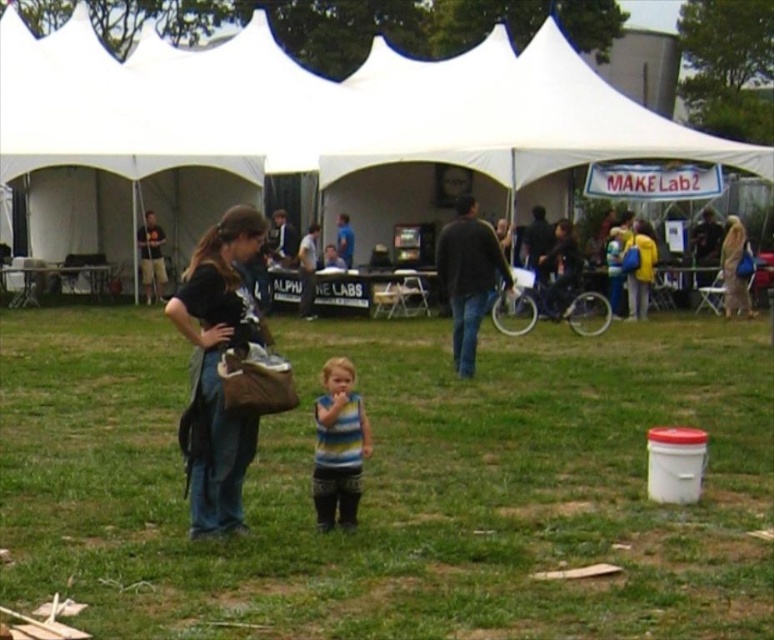
Can you confirm if white fabric tent at center is bigger than matte black shirt at center?

Correct, white fabric tent at center is larger in size than matte black shirt at center.

Image resolution: width=774 pixels, height=640 pixels. What do you see at coordinates (317, 113) in the screenshot?
I see `white fabric tent at center` at bounding box center [317, 113].

I want to click on white fabric tent at center, so click(317, 113).

The image size is (774, 640). What are the coordinates of `white fabric tent at center` in the screenshot? It's located at (317, 113).

The width and height of the screenshot is (774, 640). Describe the element at coordinates (338, 445) in the screenshot. I see `striped fabric shirt at center` at that location.

Does striped fabric shirt at center have a lesser width compared to light beige fabric bag at right?

Yes.

Is point (314, 404) positioned in front of point (741, 296)?

Yes, point (314, 404) is closer to viewer.

Find the location of a particular element. striped fabric shirt at center is located at coordinates (338, 445).

Which of these two, denim jacket at center or matte black shirt at center, stands shorter?

Standing shorter between the two is denim jacket at center.

Between point (249, 232) and point (159, 275), which one is positioned behind?

The point (159, 275) is behind.

In order to click on denim jacket at center in this screenshot , I will do [216, 369].